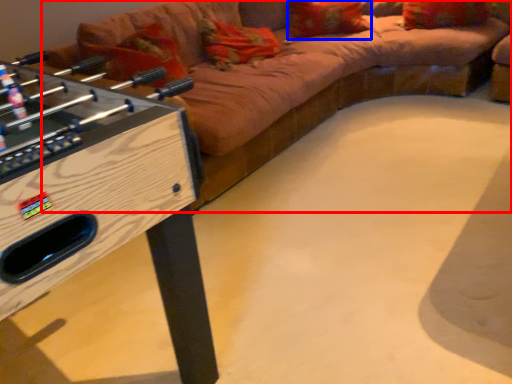
Question: Among these objects, which one is nearest to the camera, studio couch (highlighted by a red box) or pillow (highlighted by a blue box)?

Choices:
 (A) studio couch
 (B) pillow

Answer: (A)